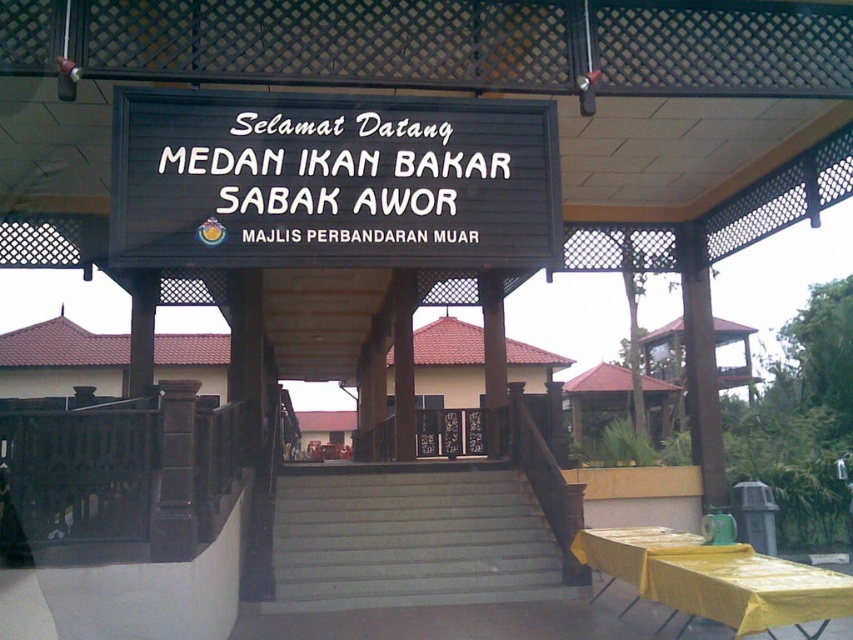
Is black wood sign at center to the left of yellow plastic table at lower right from the viewer's perspective?

Correct, you'll find black wood sign at center to the left of yellow plastic table at lower right.

Is point (310, 228) closer to camera compared to point (622, 611)?

That is True.

Between point (363, 248) and point (639, 540), which one is positioned behind?

Positioned behind is point (639, 540).

Where is `black wood sign at center`? black wood sign at center is located at coordinates (332, 180).

Who is taller, gray concrete stairs at center or yellow plastic table at lower right?

With more height is gray concrete stairs at center.

Measure the distance from gray concrete stairs at center to yellow plastic table at lower right.

A distance of 2.35 meters exists between gray concrete stairs at center and yellow plastic table at lower right.

Who is more forward, [457,584] or [839,609]?

Point [839,609]

Locate an element on the screen. gray concrete stairs at center is located at coordinates (409, 538).

Based on the photo, does black wood sign at center appear on the left side of gray concrete stairs at center?

Indeed, black wood sign at center is positioned on the left side of gray concrete stairs at center.

What do you see at coordinates (332, 180) in the screenshot?
I see `black wood sign at center` at bounding box center [332, 180].

Identify the location of black wood sign at center. The width and height of the screenshot is (853, 640). (332, 180).